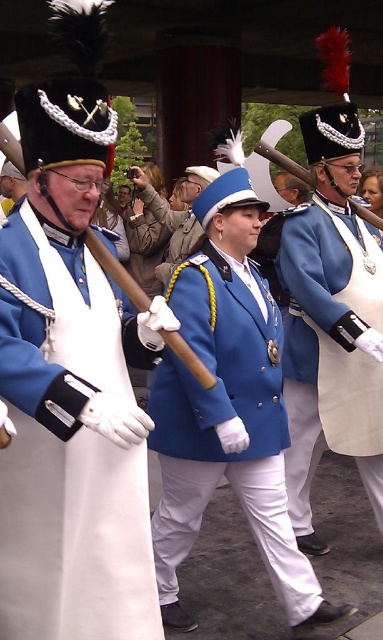
You are a photographer at the event and want to ensure that both the white matte uniform at left and the matte blue coat at center are visible in the photo. Which of the two should you focus on to ensure the shorter one is fully captured in the frame?

The white matte uniform at left is shorter than the matte blue coat at center. To ensure the shorter one is fully captured, focus on the white matte uniform at left.

You are observing a ceremonial group from the front. There are two central figures wearing a matte blue jacket at center and a matte blue coat at center. Which one is closer to you?

The matte blue jacket at center is closer to you because it is in front of the matte blue coat at center.

You are a photographer positioned at the back of the group. You want to take a photo that includes both the white matte uniform at left and the matte blue coat at center. Which object should you focus on first to ensure both are in frame?

The white matte uniform at left is thinner than the matte blue coat at center, so you should focus on the matte blue coat at center first to ensure both are in frame.